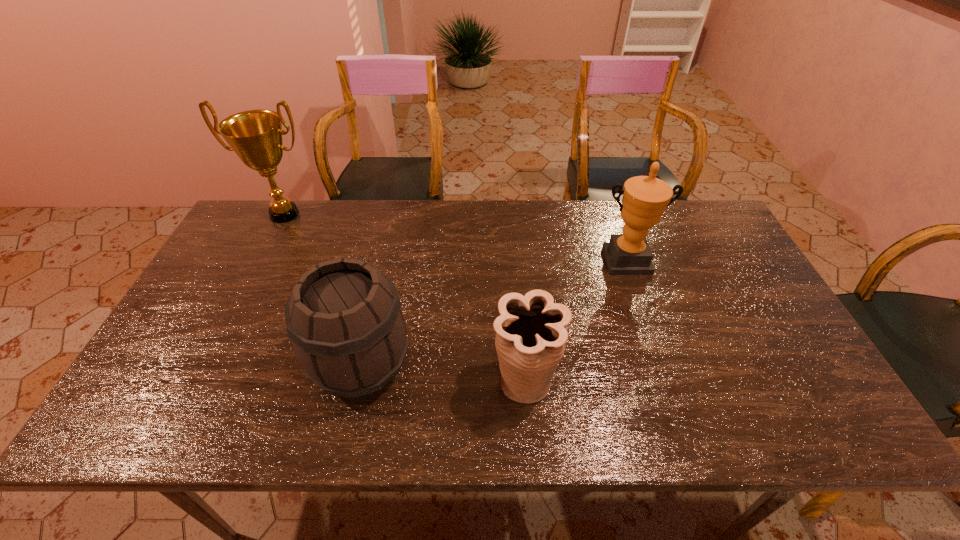
You are a GUI agent. You are given a task and a screenshot of the screen. Output one action in this format:
    pyautogui.click(x=<x>, y=<y>)
    Task: Click on the farther award
    This screenshot has height=540, width=960.
    Given the screenshot: What is the action you would take?
    pyautogui.click(x=255, y=136)

Identify the location of the left award. The image size is (960, 540). (255, 136).

Locate an element on the screen. the nearer award is located at coordinates (645, 198).

Image resolution: width=960 pixels, height=540 pixels. Find the location of `the rightmost object`. the rightmost object is located at coordinates (645, 198).

In order to click on the third object from right to left in this screenshot , I will do `click(344, 318)`.

You are a GUI agent. You are given a task and a screenshot of the screen. Output one action in this format:
    pyautogui.click(x=<x>, y=<y>)
    Task: Click on the wine bucket
    
    Given the screenshot: What is the action you would take?
    pyautogui.click(x=344, y=318)

Locate an element on the screen. Image resolution: width=960 pixels, height=540 pixels. the second object from right to left is located at coordinates (531, 333).

What are the coordinates of `urn` in the screenshot? It's located at (531, 333).

I want to click on vacant space located 0.250m on the front view with handles of the farthest object, so click(248, 287).

Find the location of a particular element. This screenshot has width=960, height=540. vacant area located at the front of the third shortest object with handles is located at coordinates [661, 366].